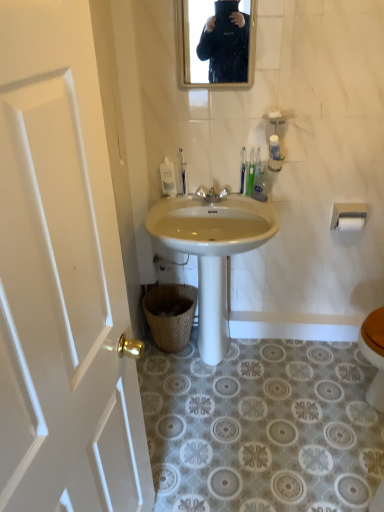
Find the location of a particular element. This screenshot has width=384, height=512. unoccupied area in front of white plastic toothbrush at upper center, which ranks as the 2th toilet brush in left-to-right order is located at coordinates (246, 205).